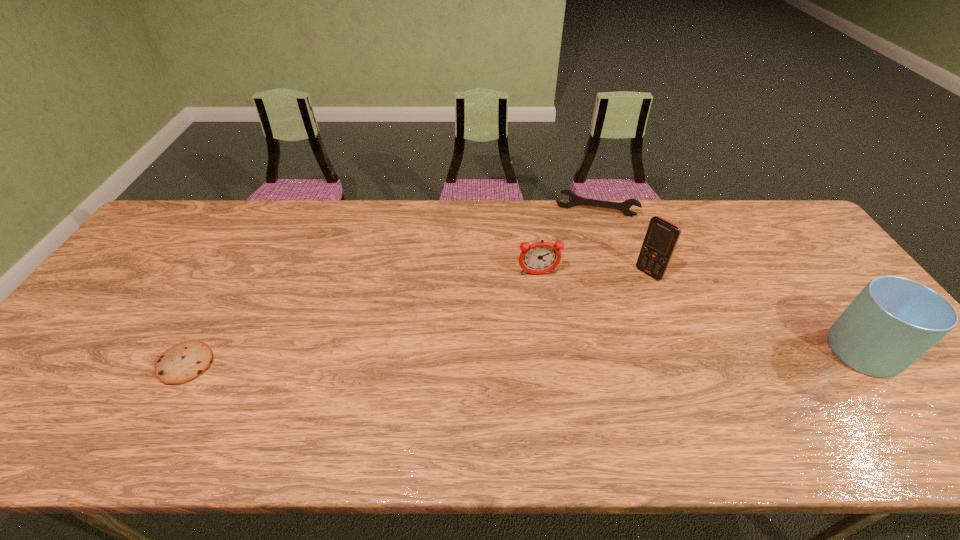
The height and width of the screenshot is (540, 960). Find the location of `free spot on the desktop that is between the shortest object and the mug and is positioned on the front-facing side of the alarm clock`. free spot on the desktop that is between the shortest object and the mug and is positioned on the front-facing side of the alarm clock is located at coordinates (556, 357).

You are a GUI agent. You are given a task and a screenshot of the screen. Output one action in this format:
    pyautogui.click(x=<x>, y=<y>)
    Task: Click on the vacant space on the desktop that is between the leftmost object and the mug and is positioned on the open ends of the wrench
    
    Given the screenshot: What is the action you would take?
    pos(586,357)

Where is `vacant space on the desktop that is between the leftmost object and the rightmost object and is positioned on the screen of the cellular telephone`? vacant space on the desktop that is between the leftmost object and the rightmost object and is positioned on the screen of the cellular telephone is located at coordinates (550, 357).